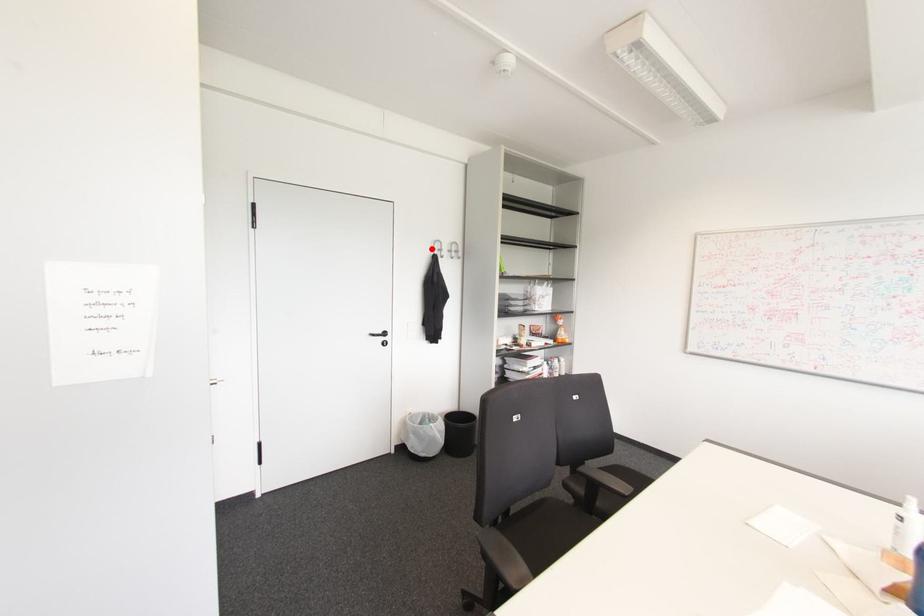
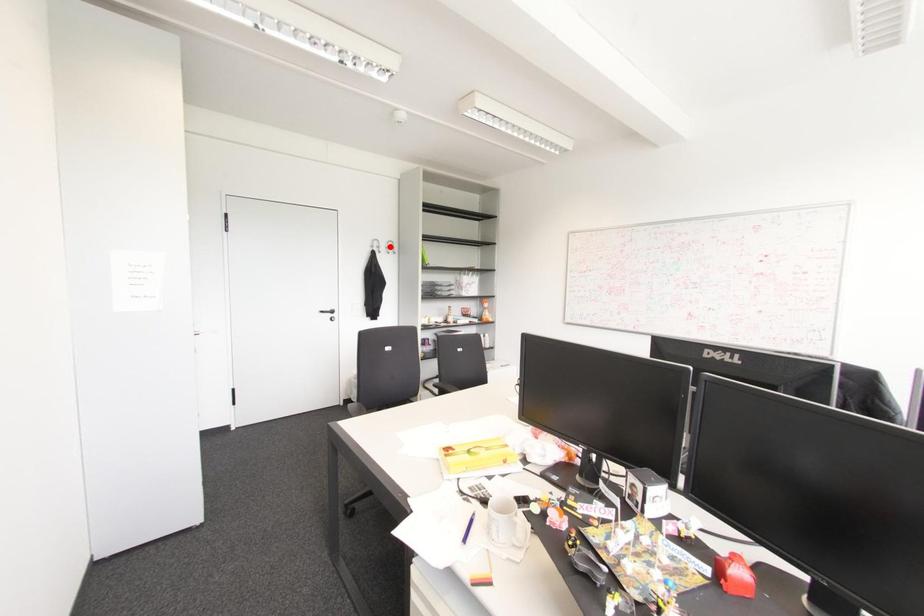
I am providing you with two images of the same scene from different viewpoints. A red point is marked on the first image and another point is marked on the second image. Is the marked point in image1 the same physical position as the marked point in image2?

No